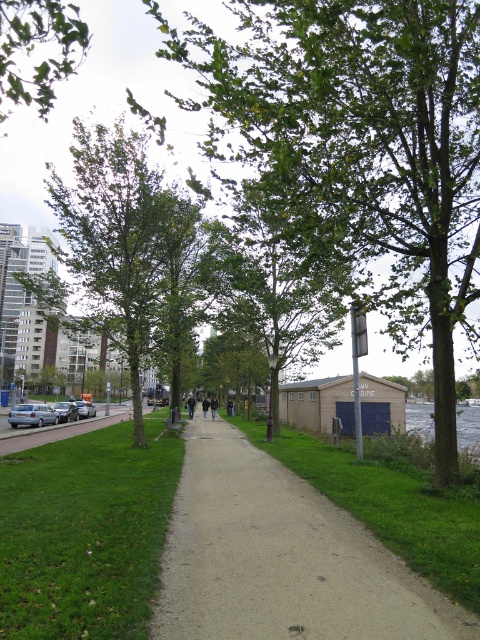
You are a tourist in the park and want to take a photo of both the green leafy tree at upper left and the silver metallic car at left. Which object should you focus on first to ensure both are in the frame?

The green leafy tree at upper left is larger in size than the silver metallic car at left, so you should focus on the green leafy tree at upper left first to ensure both fit in the frame.

You are a gardener planning to plant flowers along the edges of the smooth concrete path at center and the green grass at lower left. Which area requires more flowers if you want to cover the entire width of both areas equally?

The smooth concrete path at center is thinner than green grass at lower left, so you need to plant more flowers along the green grass at lower left to cover its wider width.